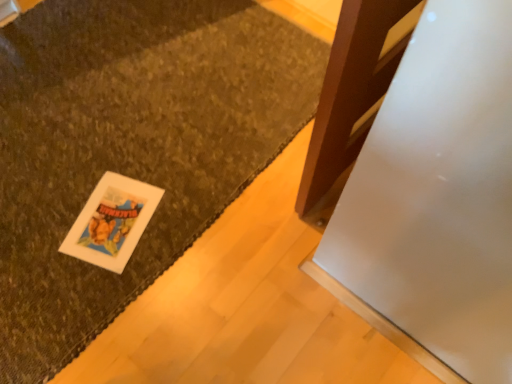
Question: Should I look upward or downward to see white matte card at lower left?

Choices:
 (A) up
 (B) down

Answer: (B)

Question: Is white matte card at lower left in front of textured brown mat at lower left?

Choices:
 (A) yes
 (B) no

Answer: (B)

Question: From the image's perspective, is white matte card at lower left below textured brown mat at lower left?

Choices:
 (A) no
 (B) yes

Answer: (B)

Question: Can you confirm if white matte card at lower left is taller than textured brown mat at lower left?

Choices:
 (A) yes
 (B) no

Answer: (B)

Question: From a real-world perspective, is white matte card at lower left on top of textured brown mat at lower left?

Choices:
 (A) yes
 (B) no

Answer: (A)

Question: From a real-world perspective, is white matte card at lower left positioned under textured brown mat at lower left based on gravity?

Choices:
 (A) no
 (B) yes

Answer: (A)

Question: Is white matte card at lower left smaller than textured brown mat at lower left?

Choices:
 (A) no
 (B) yes

Answer: (B)

Question: Can you confirm if textured brown mat at lower left is positioned to the left of white matte card at lower left?

Choices:
 (A) yes
 (B) no

Answer: (A)

Question: From the image's perspective, is textured brown mat at lower left beneath white matte card at lower left?

Choices:
 (A) no
 (B) yes

Answer: (A)

Question: Is white matte card at lower left surrounded by textured brown mat at lower left?

Choices:
 (A) yes
 (B) no

Answer: (A)

Question: Considering the relative positions of textured brown mat at lower left and white matte card at lower left in the image provided, is textured brown mat at lower left behind white matte card at lower left?

Choices:
 (A) yes
 (B) no

Answer: (B)

Question: Is textured brown mat at lower left facing away from white matte card at lower left?

Choices:
 (A) no
 (B) yes

Answer: (A)

Question: Considering the relative positions of textured brown mat at lower left and white matte card at lower left in the image provided, is textured brown mat at lower left to the right of white matte card at lower left from the viewer's perspective?

Choices:
 (A) no
 (B) yes

Answer: (A)

Question: Is white matte card at lower left taller or shorter than textured brown mat at lower left?

Choices:
 (A) tall
 (B) short

Answer: (B)